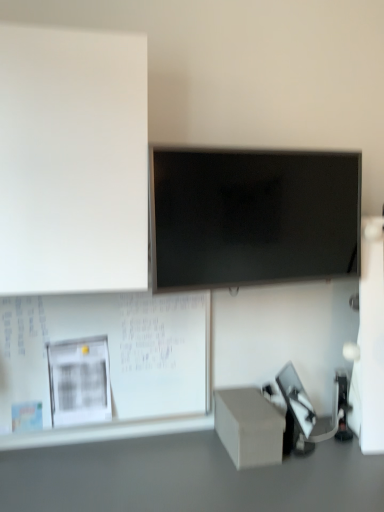
This screenshot has height=512, width=384. What are the coordinates of `vacant area located to the right-hand side of matte gray cube at lower right` in the screenshot? It's located at (332, 462).